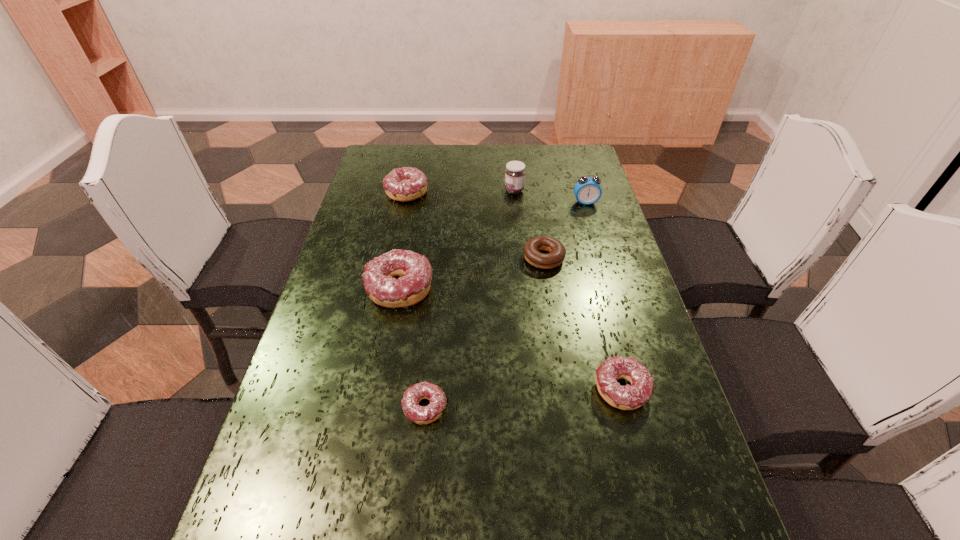
You are a GUI agent. You are given a task and a screenshot of the screen. Output one action in this format:
    pyautogui.click(x=<x>, y=<y>)
    Task: Click on the vacant space located 0.200m on the front label of the jam
    The width and height of the screenshot is (960, 540).
    Given the screenshot: What is the action you would take?
    pyautogui.click(x=445, y=191)

You are a GUI agent. You are given a task and a screenshot of the screen. Output one action in this format:
    pyautogui.click(x=<x>, y=<y>)
    Task: Click on the vacant space located 0.300m on the front label of the jam
    
    Given the screenshot: What is the action you would take?
    pyautogui.click(x=417, y=191)

This screenshot has height=540, width=960. In order to click on free point located on the front label of the jam in this screenshot , I will do `click(472, 191)`.

In order to click on vacant area located on the face of the alarm clock in this screenshot , I will do [x=589, y=215].

This screenshot has width=960, height=540. I want to click on vacant region located on the back of the tallest doughnut, so click(x=416, y=199).

The image size is (960, 540). Identify the location of free location located 0.180m on the front of the farthest pink doughnut. (396, 241).

Where is `vacant space positioned on the front of the third shortest object`? vacant space positioned on the front of the third shortest object is located at coordinates (636, 445).

Locate an element on the screen. free space located 0.170m on the back of the brown doughnut is located at coordinates (536, 211).

The width and height of the screenshot is (960, 540). In order to click on vacant space situated on the back of the smallest pink doughnut in this screenshot , I will do `click(437, 289)`.

Where is `alarm clock present at the right edge`? The image size is (960, 540). alarm clock present at the right edge is located at coordinates (587, 190).